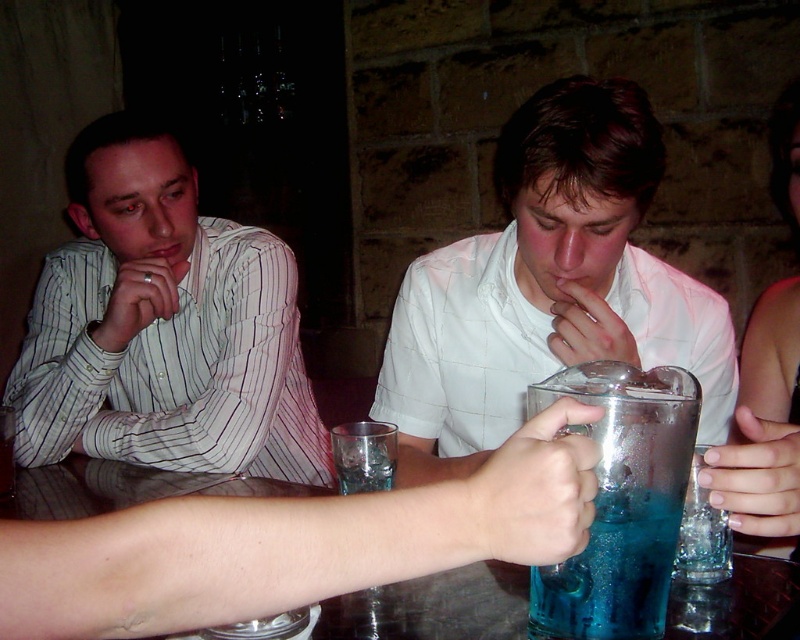
You are a bartender preparing to serve a drink to the person seated at the table. You have a clear glass at center that needs to be placed on the counter. However, there is a white matte shirt at center in the way. Can you move the glass without disturbing the shirt?

The white matte shirt at center is positioned over the clear glass at center, so you cannot move the glass without first moving the shirt.

You are a bartender who needs to reach the blue translucent liquid at center to prepare a drink. Your arm can extend 20 inches. Can you reach it without moving closer?

The blue translucent liquid at center is 21.47 inches from viewer, so no, you cannot reach it with an arm extension of 20 inches. You need to move closer.

You are a bartender who needs to place the blue translucent liquid at center into the transparent glass at center. Given that the distance between them is 22.91 inches, can you pour the liquid into the glass without moving either?

The blue translucent liquid at center and transparent glass at center are 22.91 inches apart from each other, so you cannot pour the liquid into the glass without moving either since they are too far apart.